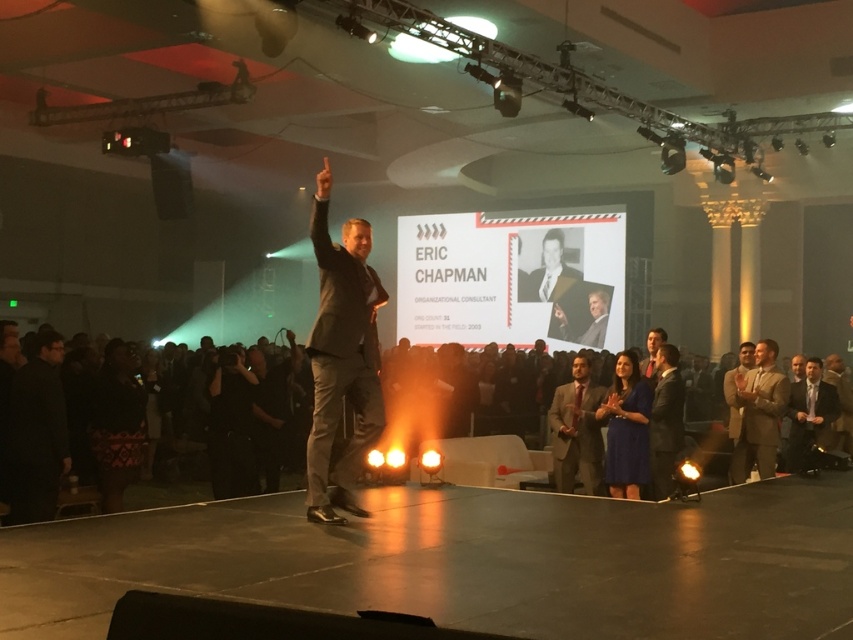
You are an event coordinator who needs to ensure the speaker in the dark gray suit at center is visible to the audience. Considering the positioning of the dark suit at lower center, is there a risk of the speaker being blocked from view?

The dark gray suit at center is in front of the dark suit at lower center, so the speaker in the dark gray suit at center is not blocked and remains visible to the audience.

You are an event photographer who needs to capture a photo of both the dark suit at lower center and the matte gold suit at right in the same frame. Based on their positions, which one should you focus on first to ensure both are in the frame?

The dark suit at lower center is positioned on the left side of matte gold suit at right. To capture both in the same frame, focus on the dark suit at lower center first as it is on the left, then adjust to include the matte gold suit at right.

From the picture: You are an event planner checking the stage setup. You notice the dark gray suit at center and the matte gold suit at right. Which suit is positioned higher on the stage?

The dark gray suit at center is located above the matte gold suit at right, meaning it is positioned higher on the stage.